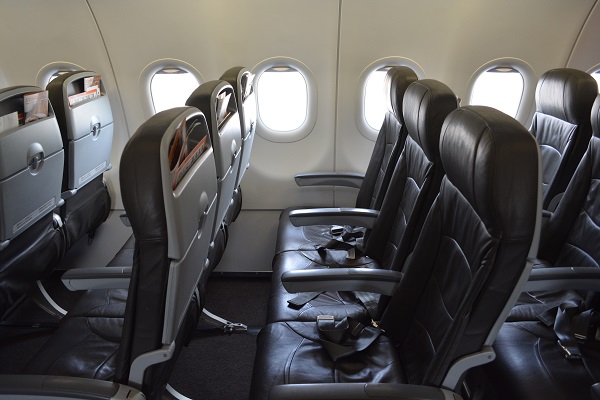
I want to click on armrests, so click(95, 278), click(125, 222), click(321, 180), click(320, 214), click(319, 277), click(332, 394), click(80, 386), click(594, 387), click(558, 277), click(546, 217).